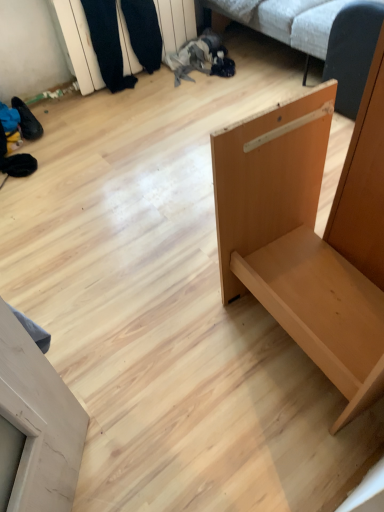
Question: Does light brown wood door at lower left, which is counted as the first furniture, starting from the left, lie in front of light brown wood shelf at right, which is the 2th furniture from left to right?

Choices:
 (A) yes
 (B) no

Answer: (A)

Question: Considering the relative sizes of light brown wood door at lower left, acting as the 2th furniture starting from the right, and light brown wood shelf at right, the 1th furniture from the right, in the image provided, is light brown wood door at lower left, acting as the 2th furniture starting from the right, bigger than light brown wood shelf at right, the 1th furniture from the right,?

Choices:
 (A) yes
 (B) no

Answer: (B)

Question: Is light brown wood door at lower left, acting as the 2th furniture starting from the right, positioned beyond the bounds of light brown wood shelf at right, the 1th furniture from the right?

Choices:
 (A) yes
 (B) no

Answer: (A)

Question: Is light brown wood door at lower left, which is counted as the first furniture, starting from the left, in contact with light brown wood shelf at right, which is the 2th furniture from left to right?

Choices:
 (A) no
 (B) yes

Answer: (A)

Question: Is light brown wood door at lower left, which is counted as the first furniture, starting from the left, to the right of light brown wood shelf at right, the 1th furniture from the right, from the viewer's perspective?

Choices:
 (A) yes
 (B) no

Answer: (B)

Question: Is the depth of light brown wood door at lower left, which is counted as the first furniture, starting from the left, greater than that of light brown wood shelf at right, which is the 2th furniture from left to right?

Choices:
 (A) yes
 (B) no

Answer: (B)

Question: Is wooden shelf at upper left far from light brown wood door at lower left, which is counted as the first furniture, starting from the left?

Choices:
 (A) yes
 (B) no

Answer: (A)

Question: Is wooden shelf at upper left aimed at light brown wood door at lower left, acting as the 2th furniture starting from the right?

Choices:
 (A) no
 (B) yes

Answer: (A)

Question: From a real-world perspective, is wooden shelf at upper left located beneath light brown wood door at lower left, acting as the 2th furniture starting from the right?

Choices:
 (A) yes
 (B) no

Answer: (A)

Question: From a real-world perspective, is wooden shelf at upper left located higher than light brown wood door at lower left, which is counted as the first furniture, starting from the left?

Choices:
 (A) yes
 (B) no

Answer: (B)

Question: From the image's perspective, is wooden shelf at upper left under light brown wood door at lower left, acting as the 2th furniture starting from the right?

Choices:
 (A) no
 (B) yes

Answer: (A)

Question: Can you confirm if wooden shelf at upper left is wider than light brown wood door at lower left, acting as the 2th furniture starting from the right?

Choices:
 (A) yes
 (B) no

Answer: (B)

Question: Considering the relative sizes of wooden shelf at upper left and white fabric couch at upper center in the image provided, is wooden shelf at upper left shorter than white fabric couch at upper center?

Choices:
 (A) no
 (B) yes

Answer: (B)